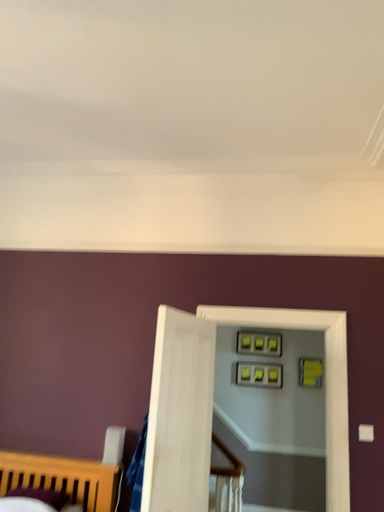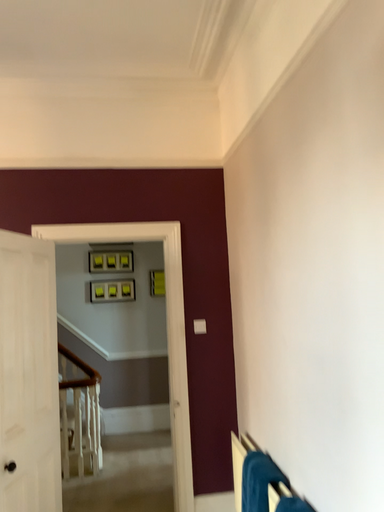
Question: Which way did the camera rotate in the video?

Choices:
 (A) rotated right
 (B) rotated left

Answer: (A)